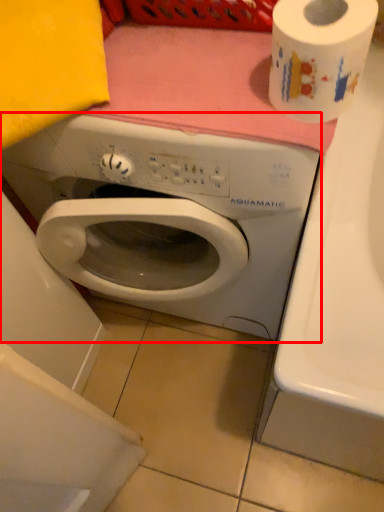
Question: In this image, where is washing machine (annotated by the red box) located relative to toilet paper?

Choices:
 (A) right
 (B) left

Answer: (B)